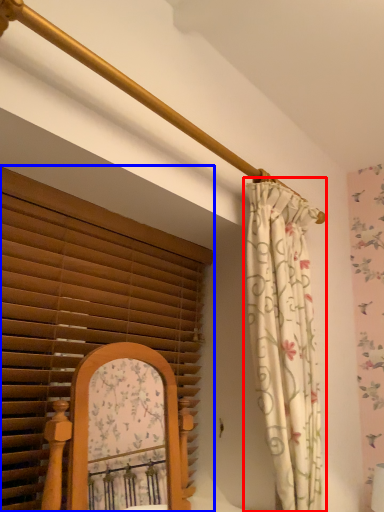
Question: Which object appears farthest to the camera in this image, curtain (highlighted by a red box) or window blind (highlighted by a blue box)?

Choices:
 (A) curtain
 (B) window blind

Answer: (A)